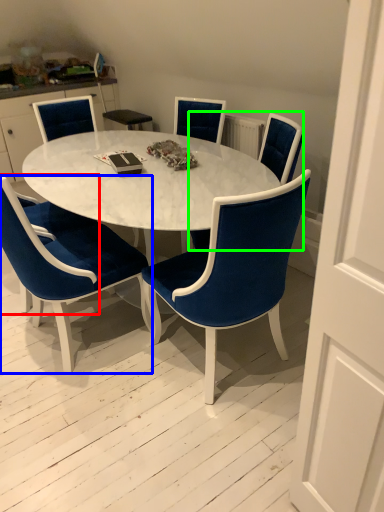
Question: Which object is positioned closest to armchair (highlighted by a red box)? Select from chair (highlighted by a blue box) and chair (highlighted by a green box).

Choices:
 (A) chair
 (B) chair

Answer: (A)